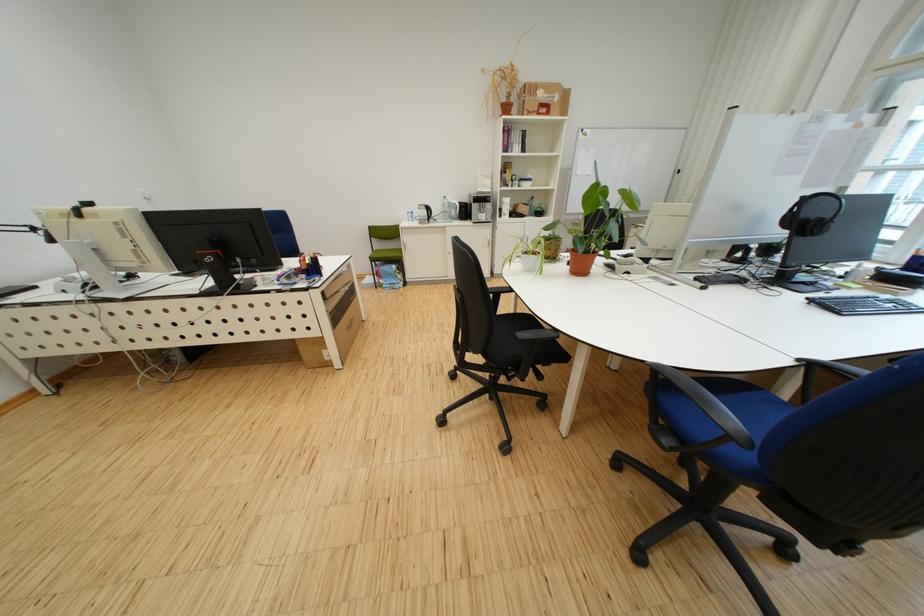
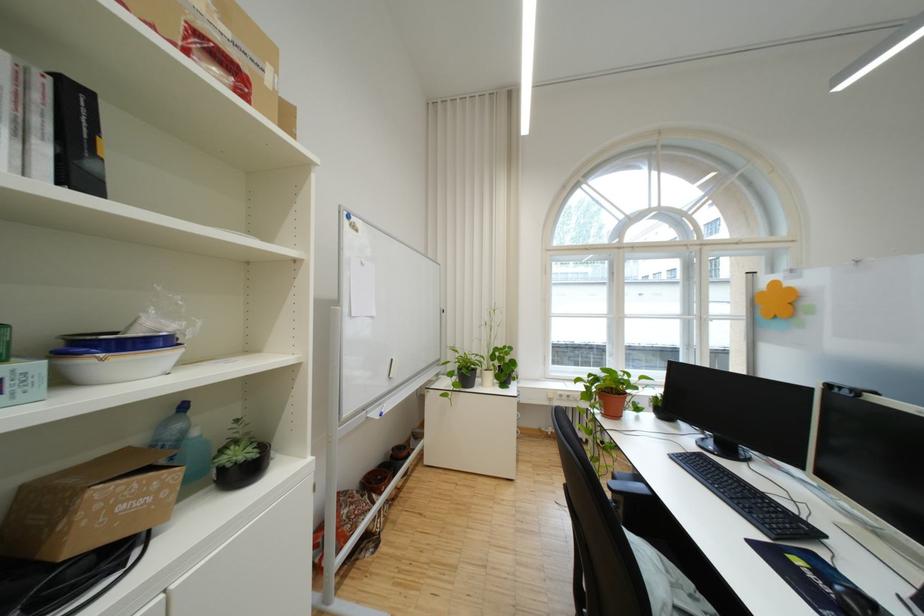
Find the pixel in the second image that matches (x=535, y=185) in the first image.

(117, 365)